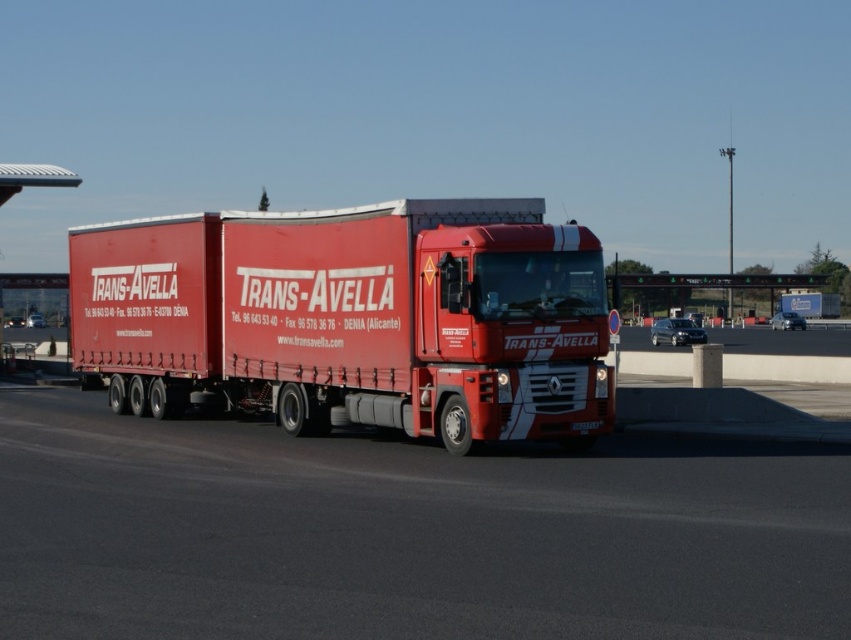
What do you see at coordinates (353, 317) in the screenshot? The width and height of the screenshot is (851, 640). I see `matte red trailer truck at center` at bounding box center [353, 317].

The height and width of the screenshot is (640, 851). I want to click on matte red trailer truck at center, so click(x=353, y=317).

Locate an element on the screen. The width and height of the screenshot is (851, 640). matte red trailer truck at center is located at coordinates (353, 317).

Where is `matte red trailer truck at center`? matte red trailer truck at center is located at coordinates (353, 317).